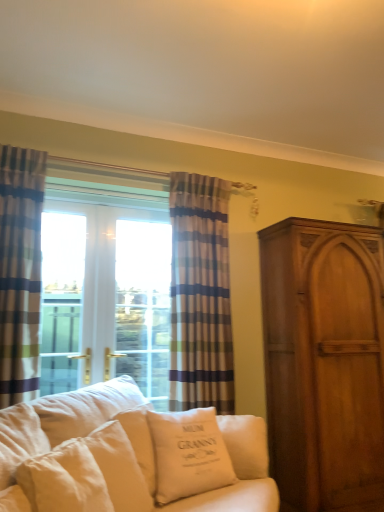
Question: From the image's perspective, is white cotton cushion at center, acting as the 2th pillow starting from the left, below striped fabric curtain at left, the 2th curtain viewed from the right?

Choices:
 (A) no
 (B) yes

Answer: (B)

Question: Considering the relative positions of white cotton cushion at center, acting as the 2th pillow starting from the left, and striped fabric curtain at left, placed as the 2th curtain when sorted from back to front, in the image provided, is white cotton cushion at center, acting as the 2th pillow starting from the left, to the right of striped fabric curtain at left, placed as the 2th curtain when sorted from back to front, from the viewer's perspective?

Choices:
 (A) yes
 (B) no

Answer: (A)

Question: Does white cotton cushion at center, acting as the 2th pillow starting from the left, have a greater width compared to striped fabric curtain at left, marked as the first curtain in a front-to-back arrangement?

Choices:
 (A) yes
 (B) no

Answer: (A)

Question: Does white cotton cushion at center, arranged as the first pillow when viewed from the right, have a larger size compared to striped fabric curtain at left, placed as the 2th curtain when sorted from back to front?

Choices:
 (A) no
 (B) yes

Answer: (B)

Question: Is white cotton cushion at center, arranged as the first pillow when viewed from the right, taller than striped fabric curtain at left, marked as the first curtain in a front-to-back arrangement?

Choices:
 (A) yes
 (B) no

Answer: (B)

Question: From a real-world perspective, is white cotton cushion at center, acting as the 2th pillow starting from the left, physically below striped fabric curtain at left, marked as the first curtain in a front-to-back arrangement?

Choices:
 (A) yes
 (B) no

Answer: (A)

Question: Is white cotton pillow at center, marked as the 1th pillow in a left-to-right arrangement, oriented away from striped fabric curtain at left, the 2th curtain viewed from the right?

Choices:
 (A) no
 (B) yes

Answer: (A)

Question: Is white cotton pillow at center, placed as the second pillow when sorted from right to left, thinner than striped fabric curtain at left, the 2th curtain viewed from the right?

Choices:
 (A) yes
 (B) no

Answer: (B)

Question: Is white cotton pillow at center, placed as the second pillow when sorted from right to left, facing towards striped fabric curtain at left, positioned as the 1th curtain in left-to-right order?

Choices:
 (A) yes
 (B) no

Answer: (B)

Question: Considering the relative positions of white cotton pillow at center, placed as the second pillow when sorted from right to left, and striped fabric curtain at left, positioned as the 1th curtain in left-to-right order, in the image provided, is white cotton pillow at center, placed as the second pillow when sorted from right to left, to the right of striped fabric curtain at left, positioned as the 1th curtain in left-to-right order, from the viewer's perspective?

Choices:
 (A) no
 (B) yes

Answer: (B)

Question: Does white cotton pillow at center, marked as the 1th pillow in a left-to-right arrangement, have a smaller size compared to striped fabric curtain at left, marked as the first curtain in a front-to-back arrangement?

Choices:
 (A) no
 (B) yes

Answer: (B)

Question: Is white cotton pillow at center, marked as the 1th pillow in a left-to-right arrangement, outside striped fabric curtain at left, the 2th curtain viewed from the right?

Choices:
 (A) no
 (B) yes

Answer: (B)

Question: Can you confirm if striped fabric curtain at left, the 2th curtain viewed from the right, is positioned to the left of white cotton pillow at center, marked as the 1th pillow in a left-to-right arrangement?

Choices:
 (A) yes
 (B) no

Answer: (A)